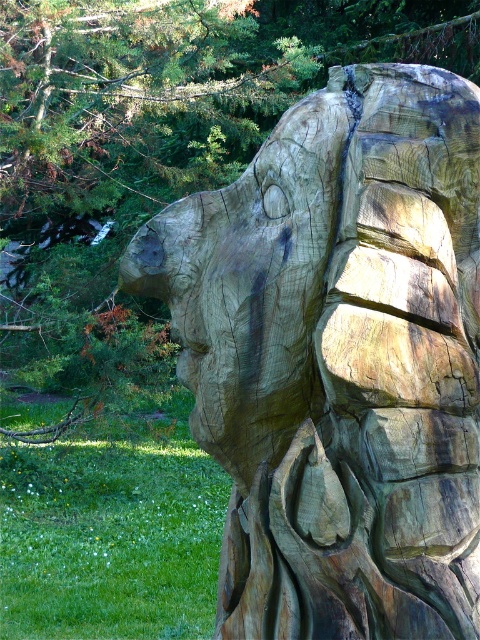
Who is positioned more to the left, natural wood carving at center or wooden carving at center?

wooden carving at center is more to the left.

Measure the distance between natural wood carving at center and camera.

natural wood carving at center is 1.77 meters away from camera.

Which is behind, point (376, 436) or point (468, 49)?

The point (468, 49) is behind.

This screenshot has height=640, width=480. Identify the location of natural wood carving at center. (338, 358).